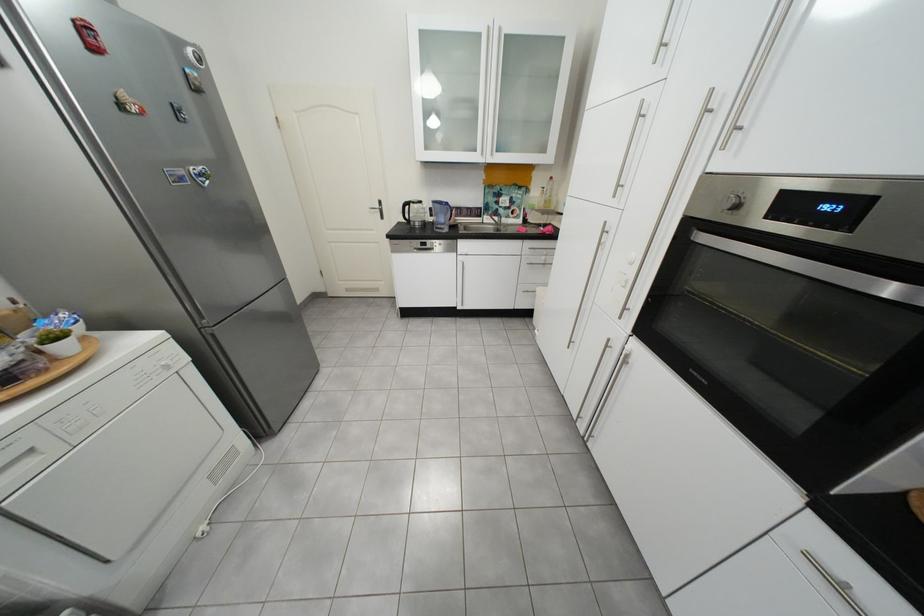
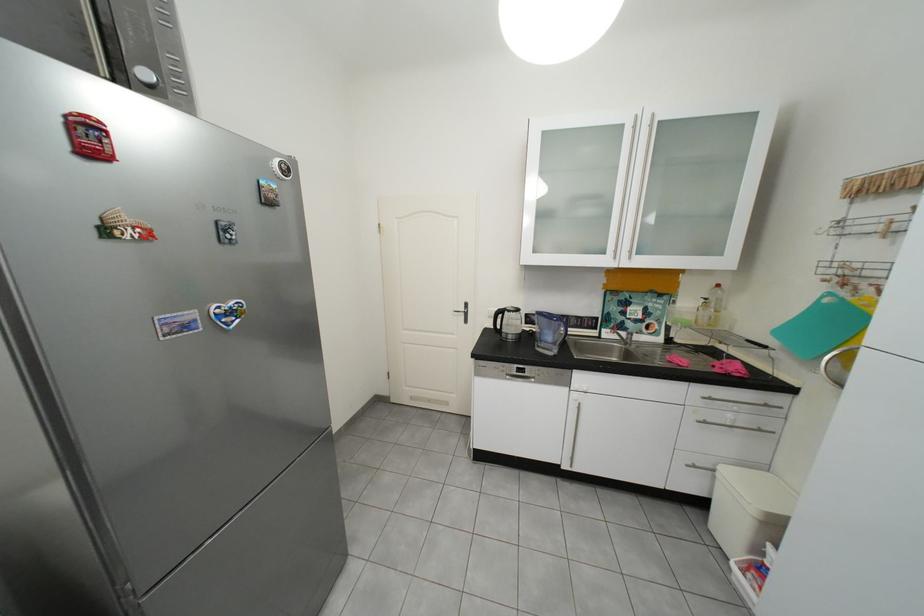
Locate, in the second image, the point that corresponds to (x=454, y=222) in the first image.

(561, 339)